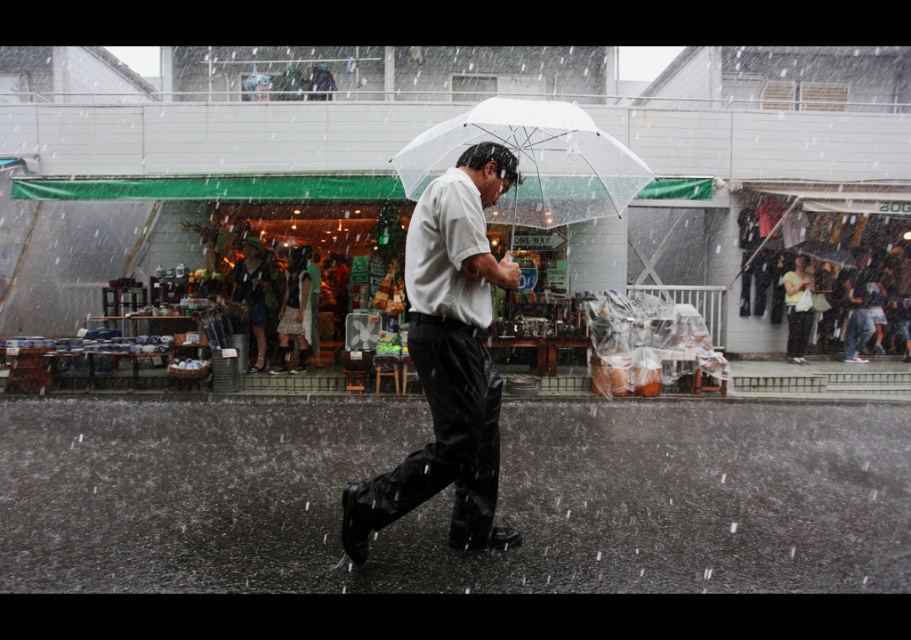
Image resolution: width=911 pixels, height=640 pixels. What do you see at coordinates (448, 360) in the screenshot? I see `white matte umbrella at center` at bounding box center [448, 360].

The image size is (911, 640). Describe the element at coordinates (448, 360) in the screenshot. I see `white matte umbrella at center` at that location.

Where is `white matte umbrella at center`? The width and height of the screenshot is (911, 640). white matte umbrella at center is located at coordinates (448, 360).